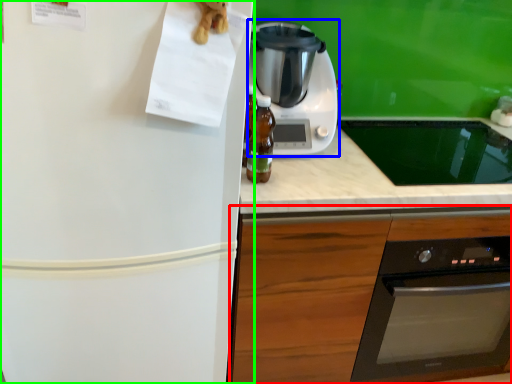
Question: Based on their relative distances, which object is nearer to cabinetry (highlighted by a red box)? Choose from kitchen appliance (highlighted by a blue box) and refrigerator (highlighted by a green box).

Choices:
 (A) kitchen appliance
 (B) refrigerator

Answer: (B)